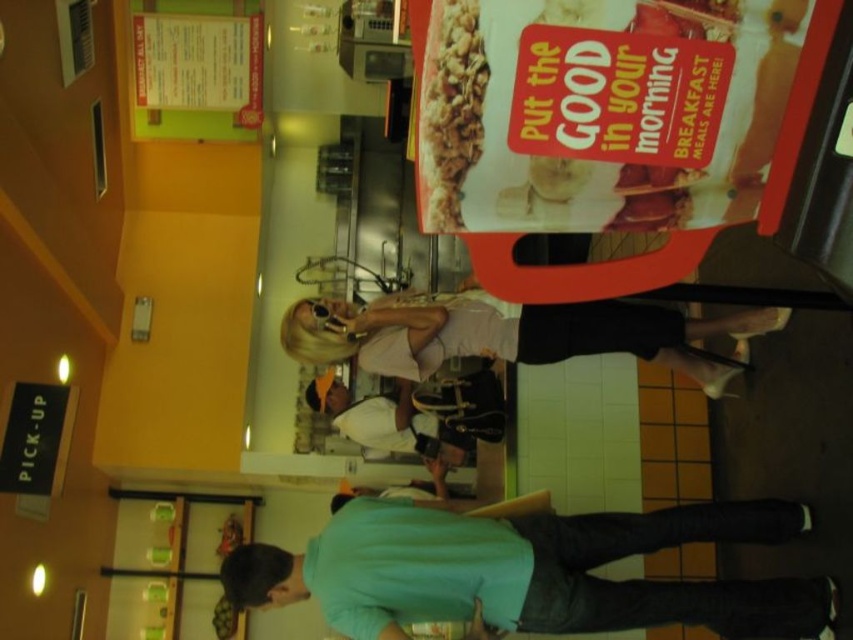
Can you confirm if crumbly granola bar at center is thinner than white fabric shirt at center?

Indeed, crumbly granola bar at center has a lesser width compared to white fabric shirt at center.

Which is more to the left, crumbly granola bar at center or white fabric shirt at center?

white fabric shirt at center is more to the left.

At what (x,y) coordinates should I click in order to perform the action: click on crumbly granola bar at center. Please return your answer as a coordinate pair (x, y). The width and height of the screenshot is (853, 640). Looking at the image, I should click on (450, 113).

Find the location of a particular element. crumbly granola bar at center is located at coordinates 450,113.

How distant is teal matte shirt at lower center from crumbly granola bar at center?

A distance of 1.52 meters exists between teal matte shirt at lower center and crumbly granola bar at center.

Which is above, teal matte shirt at lower center or crumbly granola bar at center?

crumbly granola bar at center is above.

Is point (351, 589) farther from camera compared to point (456, 182)?

Yes, point (351, 589) is farther from viewer.

Locate an element on the screen. The width and height of the screenshot is (853, 640). teal matte shirt at lower center is located at coordinates (527, 572).

Is light beige fabric dress at center to the left of crumbly granola bar at center from the viewer's perspective?

In fact, light beige fabric dress at center is to the right of crumbly granola bar at center.

What do you see at coordinates (509, 333) in the screenshot? I see `light beige fabric dress at center` at bounding box center [509, 333].

This screenshot has width=853, height=640. In order to click on light beige fabric dress at center in this screenshot , I will do `click(509, 333)`.